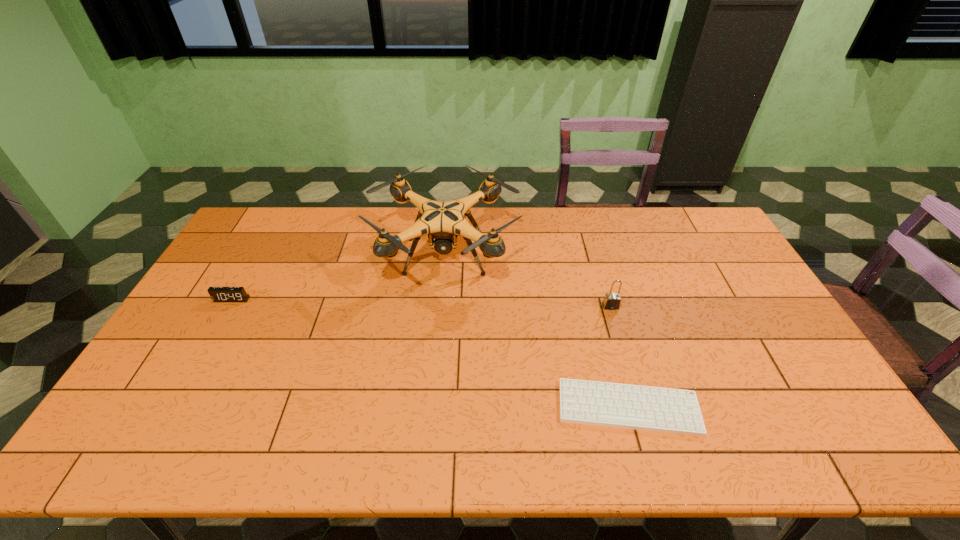
Locate an element on the screen. free space located on the back of the computer keyboard is located at coordinates (607, 329).

Identify the location of object present at the far edge. The width and height of the screenshot is (960, 540). (443, 221).

In order to click on object that is positioned at the near edge in this screenshot , I will do coord(666,410).

Image resolution: width=960 pixels, height=540 pixels. Identify the location of object positioned at the left edge. (218, 294).

Locate an element on the screen. blank space at the far edge is located at coordinates (612, 213).

At what (x,y) coordinates should I click in order to perform the action: click on vacant space at the near edge. Please return your answer as a coordinate pair (x, y). Image resolution: width=960 pixels, height=540 pixels. Looking at the image, I should click on (278, 438).

In the image, there is a desktop. Identify the location of vacant space at the left edge. Image resolution: width=960 pixels, height=540 pixels. (231, 328).

This screenshot has width=960, height=540. In the image, there is a desktop. Identify the location of vacant area at the right edge. [763, 366].

Where is `vacant area between the tallest object and the leftmost object`? This screenshot has width=960, height=540. vacant area between the tallest object and the leftmost object is located at coordinates (339, 278).

Locate an element on the screen. The height and width of the screenshot is (540, 960). free point between the padlock and the second object from left to right is located at coordinates (528, 281).